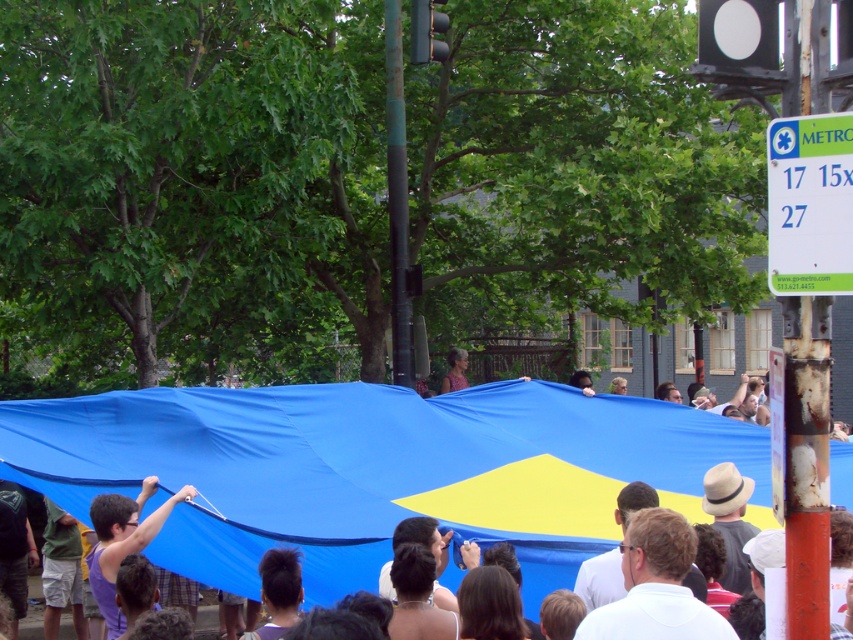
Question: Which object appears closest to the camera in this image?

Choices:
 (A) blue tarpaulin at center
 (B) green plastic sign at upper right
 (C) white matte shirt at center
 (D) purple fabric at center

Answer: (B)

Question: Which point is closer to the camera taking this photo?

Choices:
 (A) (134, 506)
 (B) (691, 620)

Answer: (B)

Question: Can you confirm if blue tarpaulin at center is positioned below green plastic sign at upper right?

Choices:
 (A) yes
 (B) no

Answer: (A)

Question: Where is green plastic sign at upper right located in relation to matte brown hair at center in the image?

Choices:
 (A) above
 (B) below

Answer: (A)

Question: Which point is farther from the camera taking this photo?

Choices:
 (A) (619, 552)
 (B) (457, 356)
 (C) (15, 436)

Answer: (B)

Question: Is purple fabric at center below matte brown hair at center?

Choices:
 (A) no
 (B) yes

Answer: (B)